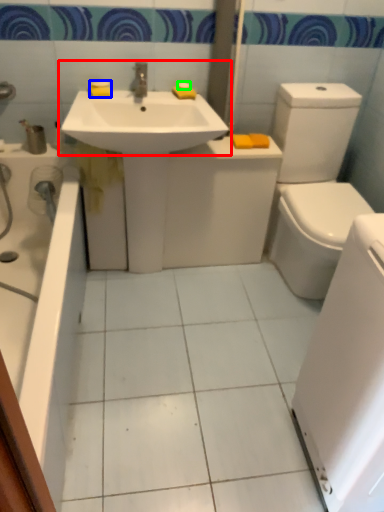
Question: Estimate the real-world distances between objects in this image. Which object is closer to sink (highlighted by a red box), soap (highlighted by a blue box) or soap (highlighted by a green box)?

Choices:
 (A) soap
 (B) soap

Answer: (A)